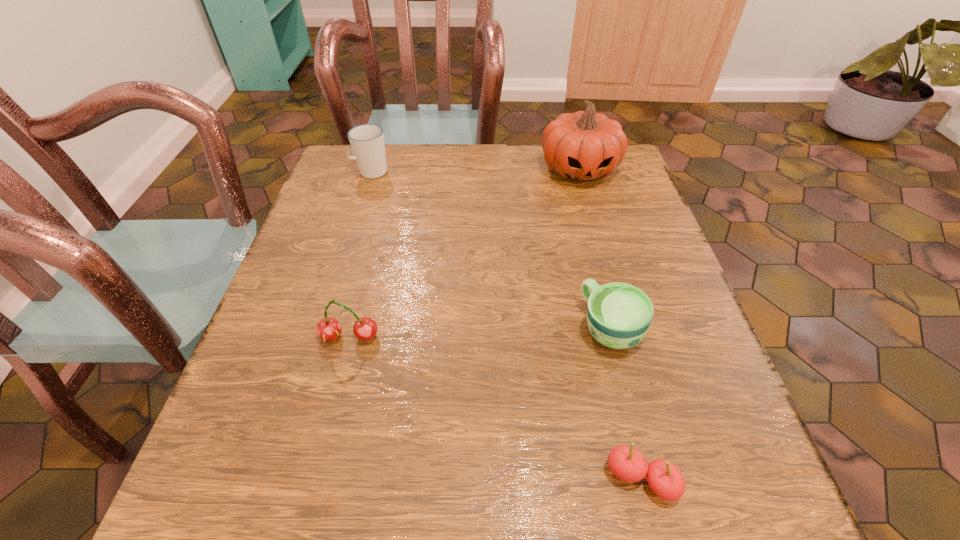
You are a GUI agent. You are given a task and a screenshot of the screen. Output one action in this format:
    pyautogui.click(x=<x>, y=<y>)
    Task: Click on the tallest object
    
    Given the screenshot: What is the action you would take?
    pyautogui.click(x=584, y=146)

You are a GUI agent. You are given a task and a screenshot of the screen. Output one action in this format:
    pyautogui.click(x=<x>, y=<y>)
    Task: Click on the farther cup
    
    Given the screenshot: What is the action you would take?
    pyautogui.click(x=367, y=141)

This screenshot has width=960, height=540. In order to click on the taller cup in this screenshot , I will do `click(367, 141)`.

I want to click on the taller cherry, so click(328, 329).

Locate an element on the screen. the left cherry is located at coordinates [328, 329].

The width and height of the screenshot is (960, 540). Find the location of `the right cup`. the right cup is located at coordinates (619, 315).

Where is `the shorter cup`? the shorter cup is located at coordinates (619, 315).

Locate an element on the screen. the shorter cherry is located at coordinates (628, 464).

This screenshot has width=960, height=540. In order to click on the nearest object in this screenshot , I will do `click(628, 464)`.

Find the location of a particular element. free space located 0.140m on the face of the pumpkin is located at coordinates (596, 230).